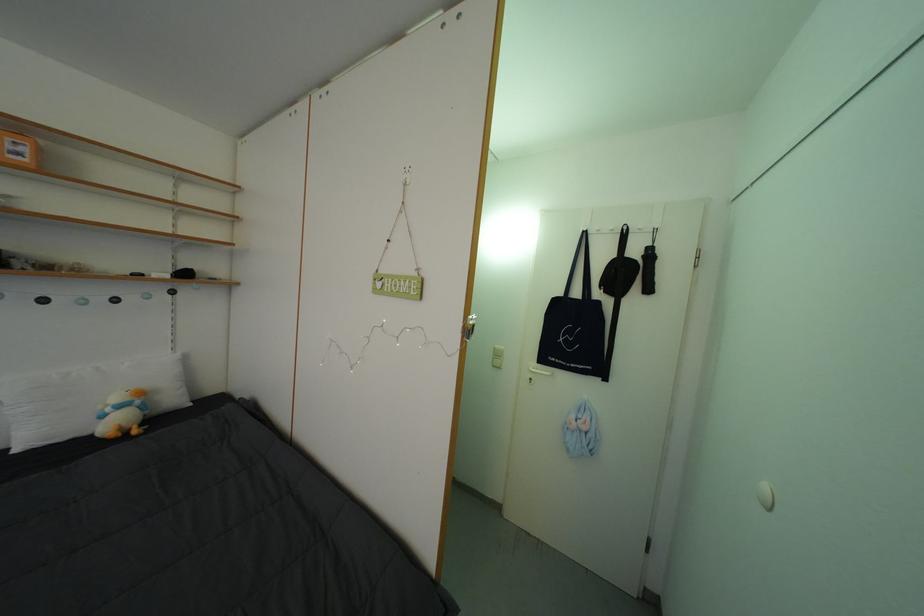
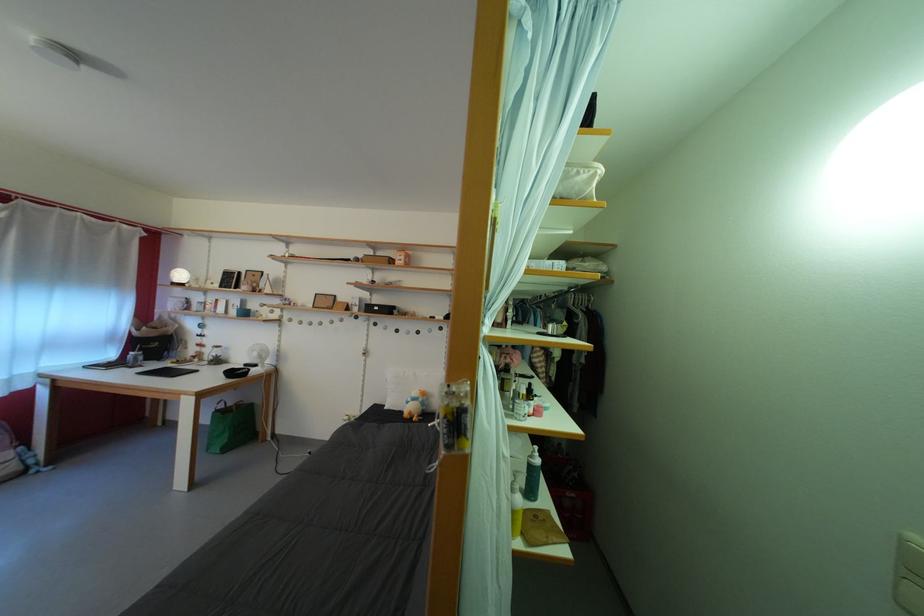
Question: The images are taken continuously from a first-person perspective. In which direction is your viewpoint rotating?

Choices:
 (A) Left
 (B) Right
 (C) Up
 (D) Down

Answer: (A)